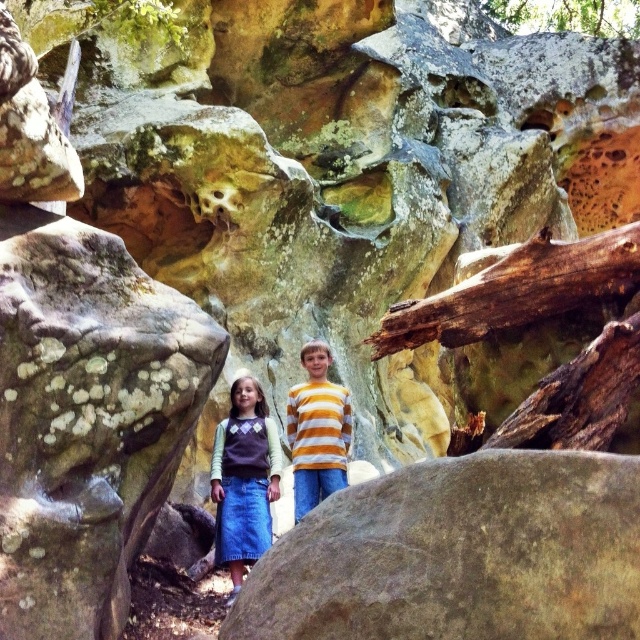
Who is positioned more to the left, smooth gray rock at center or striped cotton shirt at center?

striped cotton shirt at center is more to the left.

Can you confirm if smooth gray rock at center is smaller than striped cotton shirt at center?

Yes, smooth gray rock at center is smaller than striped cotton shirt at center.

Is point (564, 616) positioned behind point (300, 461)?

That is False.

What are the coordinates of `smooth gray rock at center` in the screenshot? It's located at (458, 554).

Does speckled stone boulder at center have a lesser width compared to blue denim skirt at lower left?

No, speckled stone boulder at center is not thinner than blue denim skirt at lower left.

Is speckled stone boulder at center below blue denim skirt at lower left?

No, speckled stone boulder at center is not below blue denim skirt at lower left.

The height and width of the screenshot is (640, 640). What do you see at coordinates (86, 419) in the screenshot?
I see `speckled stone boulder at center` at bounding box center [86, 419].

Locate an element on the screen. The width and height of the screenshot is (640, 640). speckled stone boulder at center is located at coordinates (86, 419).

Does yellow striped shirt at center appear over green leafy tree at upper right?

Incorrect, yellow striped shirt at center is not positioned above green leafy tree at upper right.

Is point (323, 388) positioned before point (513, 28)?

Yes, point (323, 388) is in front of point (513, 28).

Who is more forward, [324,406] or [540,12]?

Point [324,406] is in front.

I want to click on yellow striped shirt at center, so tap(317, 429).